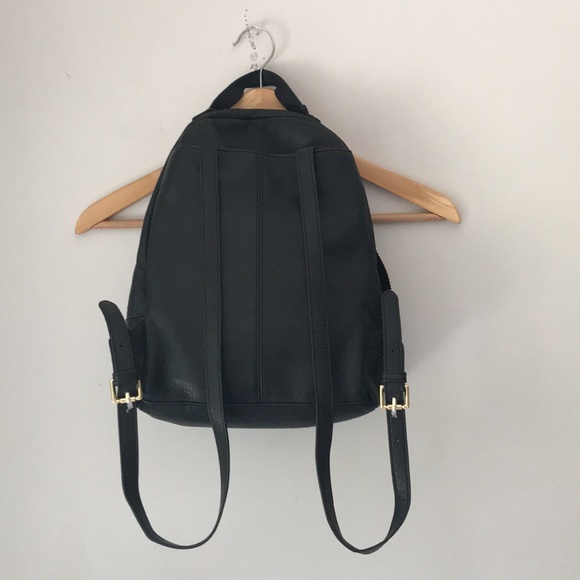
Find the location of a particular element. Image resolution: width=580 pixels, height=580 pixels. wooden hanger is located at coordinates tap(412, 195).